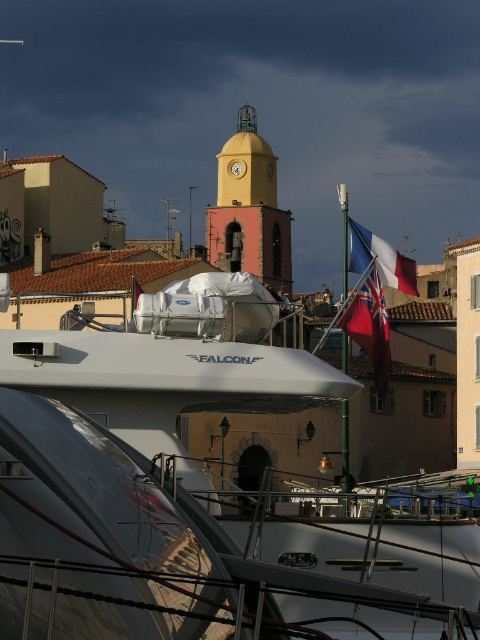
Between point (181, 624) and point (352, 252), which one is positioned behind?

Positioned behind is point (352, 252).

Where is `white glossy boat at center`? The image size is (480, 640). white glossy boat at center is located at coordinates [x=199, y=497].

Is point (168, 401) positioned in front of point (370, 236)?

Yes, point (168, 401) is in front of point (370, 236).

Locate an element on the screen. The height and width of the screenshot is (640, 480). white glossy boat at center is located at coordinates (199, 497).

Which is below, red fabric flag at center or matte fabric flag at upper center?

red fabric flag at center

Is point (377, 356) positioned after point (358, 272)?

That is True.

Describe the element at coordinates (370, 326) in the screenshot. I see `red fabric flag at center` at that location.

Where is `red fabric flag at center`? The width and height of the screenshot is (480, 640). red fabric flag at center is located at coordinates (370, 326).

Between white glossy boat at center and red fabric flag at center, which one has less height?

Standing shorter between the two is red fabric flag at center.

Is point (123, 368) less distant than point (347, 316)?

That is True.

Find the location of a particular element. white glossy boat at center is located at coordinates (199, 497).